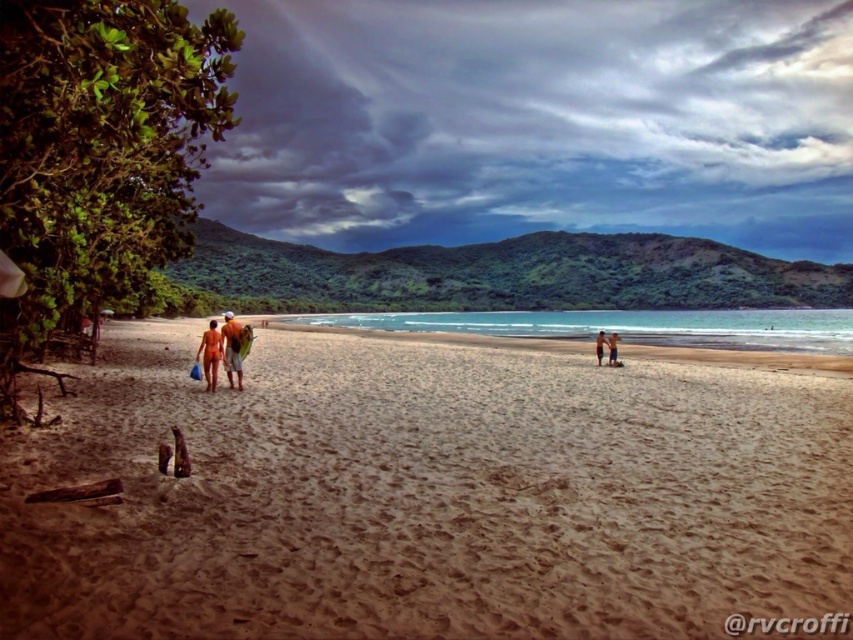
You are a photographer trying to capture a clear shot of the tan skin human at center without the orange fabric shorts at center blocking the view. Is it possible to adjust your position to achieve this?

The orange fabric shorts at center is in front of the tan skin human at center, so moving your position behind the tan skin human at center would allow you to capture them without obstruction from the orange fabric shorts at center.